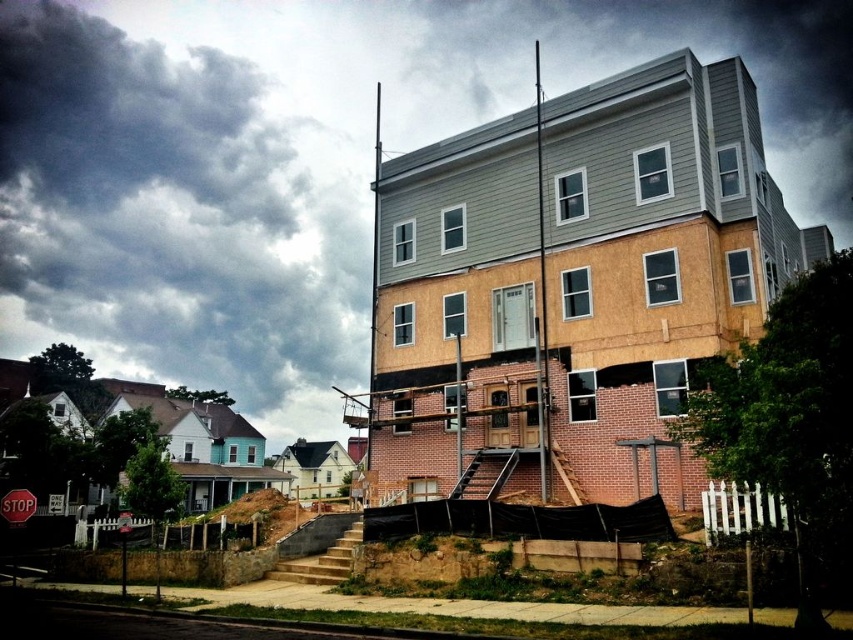
Question: Which object appears farthest from the camera in this image?

Choices:
 (A) red matte stop sign at lower left
 (B) brown dirt at lower left
 (C) cloudy sky at upper left

Answer: (C)

Question: Estimate the real-world distances between objects in this image. Which object is closer to the smooth gray siding at upper center?

Choices:
 (A) cloudy sky at upper left
 (B) red matte stop sign at lower left

Answer: (A)

Question: Which object appears farthest from the camera in this image?

Choices:
 (A) red matte stop sign at lower left
 (B) cloudy sky at upper left

Answer: (B)

Question: Does smooth gray siding at upper center appear over red matte stop sign at lower left?

Choices:
 (A) yes
 (B) no

Answer: (A)

Question: Does smooth gray siding at upper center have a smaller size compared to brown dirt at lower left?

Choices:
 (A) yes
 (B) no

Answer: (B)

Question: Where is smooth gray siding at upper center located in relation to cloudy sky at upper left in the image?

Choices:
 (A) right
 (B) left

Answer: (A)